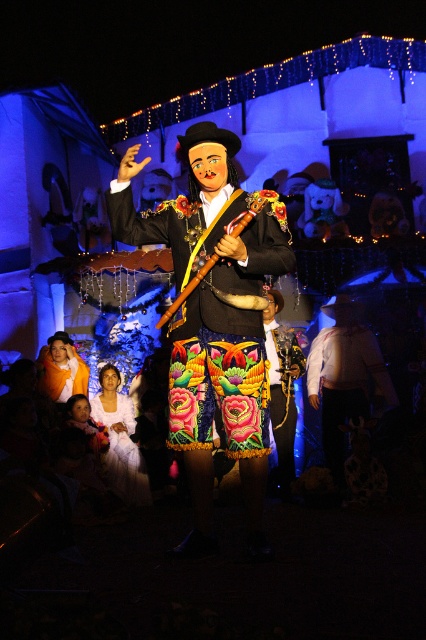
Does matte black mariachi at center have a smaller size compared to wooden flute at center?

Indeed, matte black mariachi at center has a smaller size compared to wooden flute at center.

Find the location of `matte black mariachi at center`. matte black mariachi at center is located at coordinates (213, 321).

Is point (264, 548) positioned in front of point (264, 189)?

That is True.

Where is `matte black mariachi at center`? This screenshot has height=640, width=426. matte black mariachi at center is located at coordinates (213, 321).

Does matte black mariachi at center appear on the right side of orange fabric at center?

Yes, matte black mariachi at center is to the right of orange fabric at center.

Can you confirm if matte black mariachi at center is positioned below orange fabric at center?

Actually, matte black mariachi at center is above orange fabric at center.

Is point (241, 280) farther from viewer compared to point (48, 356)?

No.

Identify the location of matte black mariachi at center. (213, 321).

Based on the photo, between orange fabric at center and wooden flute at center, which one has more height?

Standing taller between the two is wooden flute at center.

Which of these two, orange fabric at center or wooden flute at center, stands shorter?

With less height is orange fabric at center.

At what (x,y) coordinates should I click in order to perform the action: click on orange fabric at center. Please return your answer as a coordinate pair (x, y). The image size is (426, 640). Looking at the image, I should click on (62, 369).